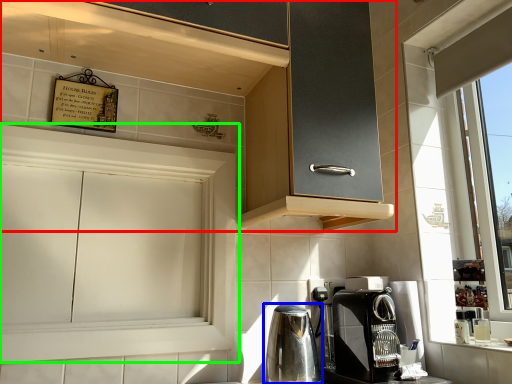
Question: Estimate the real-world distances between objects in this image. Which object is farther from cabinetry (highlighted by a red box), home appliance (highlighted by a blue box) or cabinetry (highlighted by a green box)?

Choices:
 (A) home appliance
 (B) cabinetry

Answer: (A)